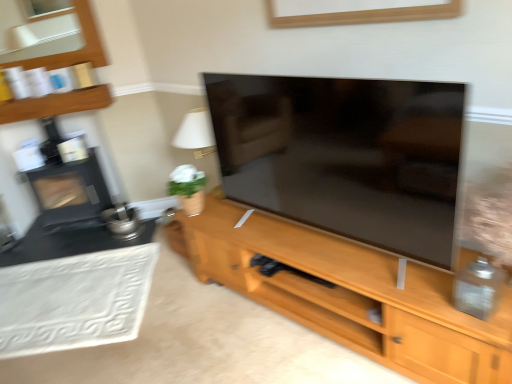
You are a GUI agent. You are given a task and a screenshot of the screen. Output one action in this format:
    pyautogui.click(x=<x>, y=<y>)
    Task: Click on the free location above wooden shelf at upper left (from a real-world perspective)
    The width and height of the screenshot is (512, 384).
    Given the screenshot: What is the action you would take?
    pyautogui.click(x=60, y=92)